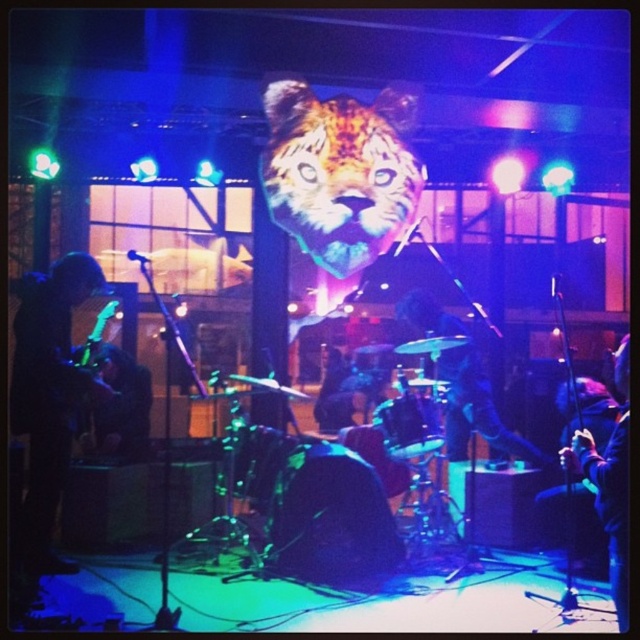
Does shiny black guitar at lower right have a smaller size compared to smooth black drum at center?

No.

In the scene shown: Can you confirm if shiny black guitar at lower right is taller than smooth black drum at center?

Correct, shiny black guitar at lower right is much taller as smooth black drum at center.

Between point (621, 545) and point (406, 440), which one is positioned behind?

Point (406, 440)

Image resolution: width=640 pixels, height=640 pixels. Find the location of `shiny black guitar at lower right`. shiny black guitar at lower right is located at coordinates (609, 483).

Between shiny orange tiger head at center and black matte drum at center, which one has more height?

shiny orange tiger head at center

Find the location of a particular element. shiny orange tiger head at center is located at coordinates (339, 172).

Which of these two, black matte drum at center or shiny metallic drum at center, stands taller?

black matte drum at center

Between black matte drum at center and shiny metallic drum at center, which one has less height?

Standing shorter between the two is shiny metallic drum at center.

The image size is (640, 640). I want to click on black matte drum at center, so pyautogui.click(x=330, y=516).

Find the location of a particular element. This screenshot has width=640, height=640. black matte drum at center is located at coordinates (330, 516).